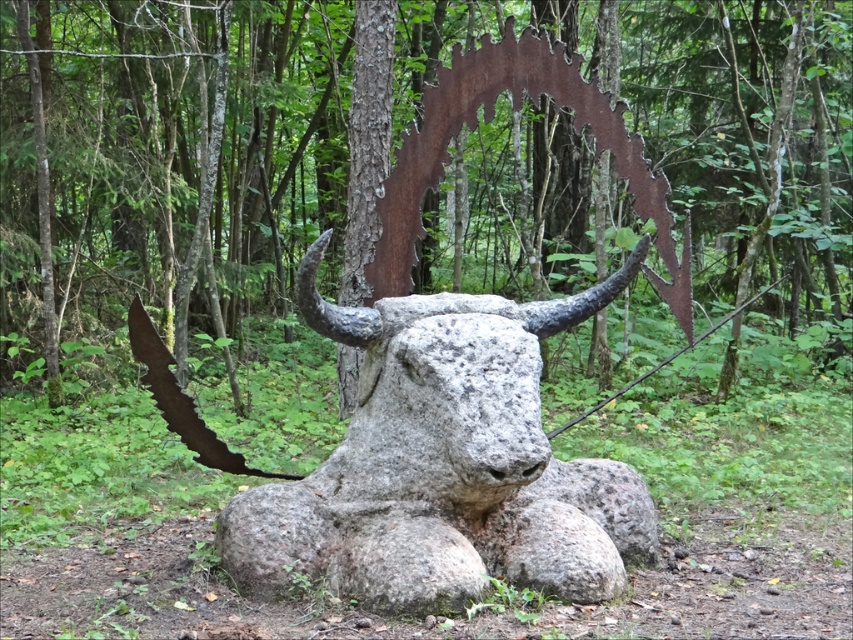
Question: Which of the following is the farthest from the observer?

Choices:
 (A) (610, 76)
 (B) (421, 596)

Answer: (A)

Question: Does rusty metal tree at center appear on the right side of gray stone bull at center?

Choices:
 (A) yes
 (B) no

Answer: (A)

Question: Is rusty metal tree at center to the right of gray stone bull at center from the viewer's perspective?

Choices:
 (A) no
 (B) yes

Answer: (B)

Question: Is rusty metal tree at center bigger than gray stone bull at center?

Choices:
 (A) no
 (B) yes

Answer: (A)

Question: Which point is farther to the camera?

Choices:
 (A) (561, 264)
 (B) (280, 484)

Answer: (A)